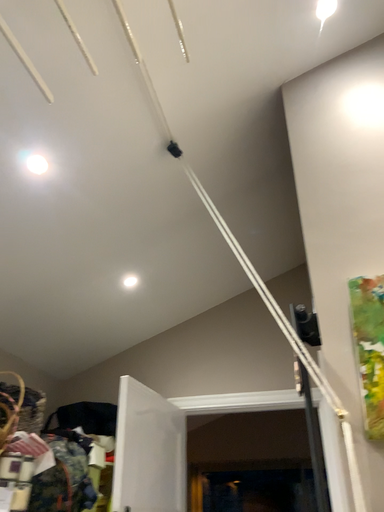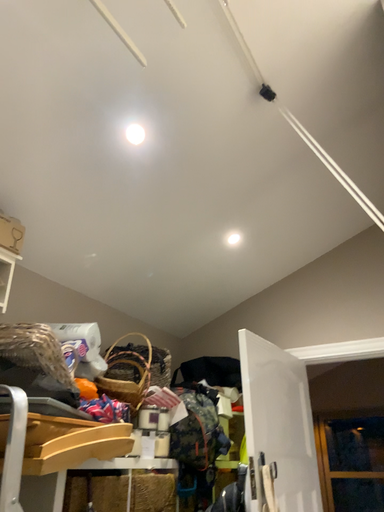
Question: How did the camera likely rotate when shooting the video?

Choices:
 (A) rotated downward
 (B) rotated upward

Answer: (A)